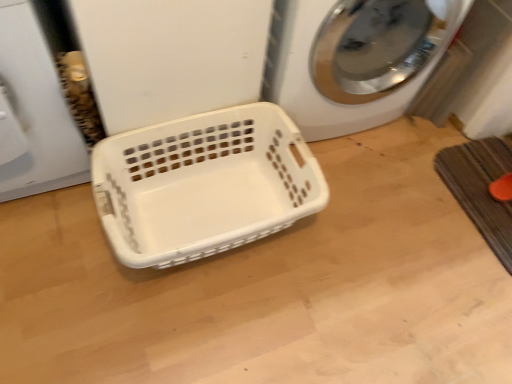
Question: In terms of width, does white plastic basket at center look wider or thinner when compared to white plastic washing machine at center?

Choices:
 (A) thin
 (B) wide

Answer: (A)

Question: From a real-world perspective, is white plastic basket at center above or below white plastic washing machine at center?

Choices:
 (A) below
 (B) above

Answer: (A)

Question: Based on their relative distances, which object is nearer to the brown textured bath mat at lower right?

Choices:
 (A) white plastic basket at center
 (B) white plastic washing machine at center

Answer: (B)

Question: Estimate the real-world distances between objects in this image. Which object is closer to the brown textured bath mat at lower right?

Choices:
 (A) white plastic basket at center
 (B) white plastic washing machine at center

Answer: (B)